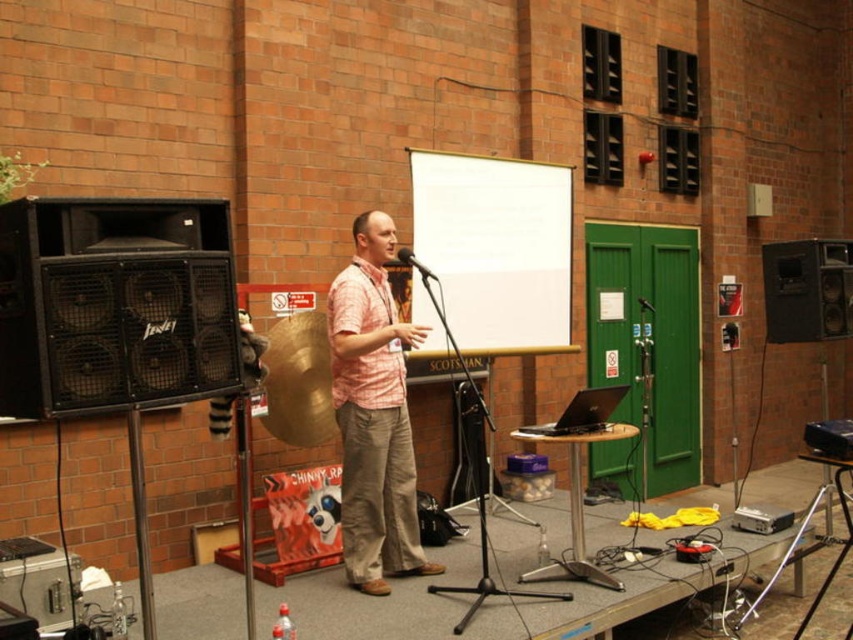
You are an event organizer who needs to place a new podium for the speaker. The existing black matte speaker at right is located at coordinates 0.455 on the x and 0.947 on the y. Where should you position the podium relative to the speaker?

The podium should be placed in front of the black matte speaker at right, ensuring it is positioned at a comfortable distance for the speaker to move freely while addressing the audience.

You are attending a presentation and need to locate the white matte projection screen at center. Can you confirm if the point at coordinates (495, 248) is on the screen?

Yes, the point at coordinates (495, 248) is on the white matte projection screen at center as stated in the description.

You are an event assistant and need to adjust the microphone stand so that the matte black microphone at center is positioned closer to the speaker. However, you must ensure that the microphone doesn not block the view of the white matte projection screen at center. Based on their current positions, is this adjustment possible?

The white matte projection screen at center is to the right of the matte black microphone at center. Since the microphone is currently positioned in front of the speaker and the screen is to the right of the microphone, adjusting the microphone stand closer to the speaker would move it further away from the screen. This adjustment would not block the screen, so it is possible.